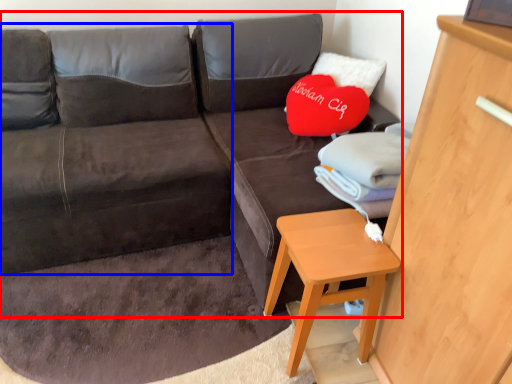
Question: Which point is further to the camera, studio couch (highlighted by a red box) or bean bag chair (highlighted by a blue box)?

Choices:
 (A) studio couch
 (B) bean bag chair

Answer: (B)